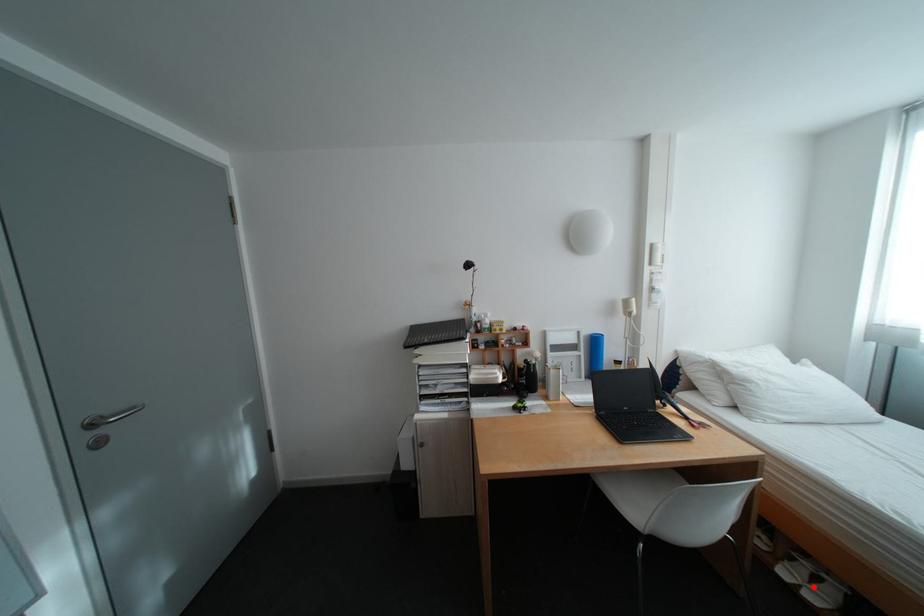
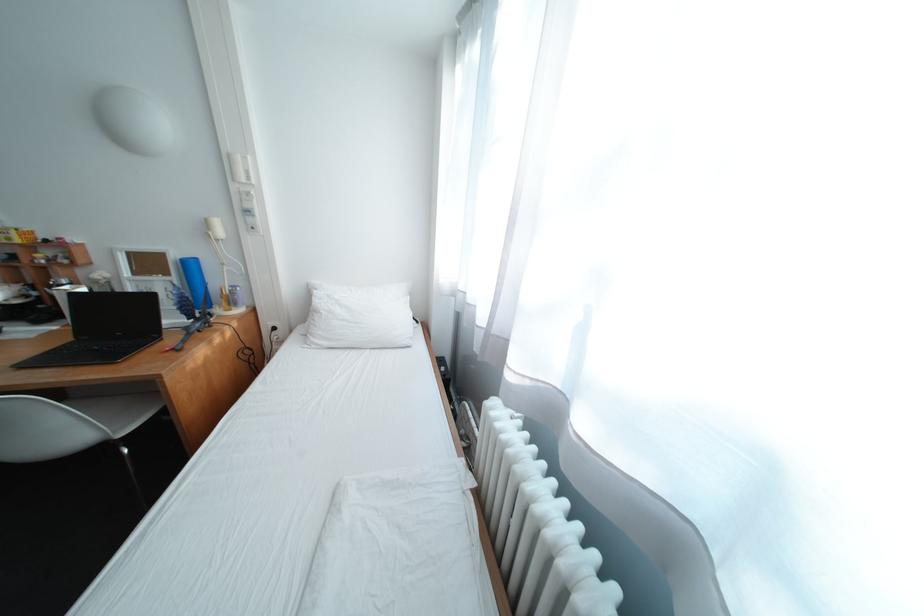
Question: I am providing you with two images of the same scene from different viewpoints. A red point is marked on the first image. At the location where the point appears in image 1, is it still visible in image 2?

Choices:
 (A) Yes
 (B) No

Answer: (B)